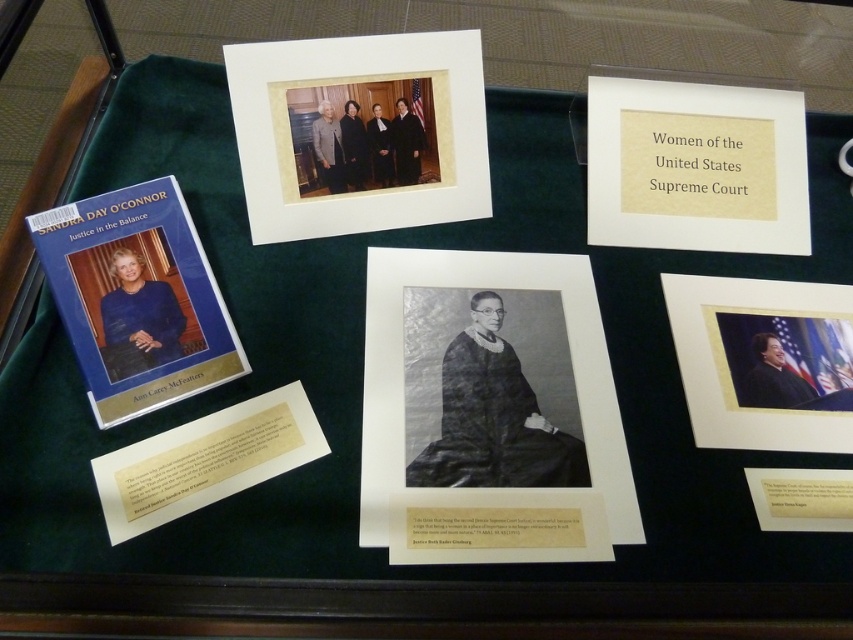
You are a museum visitor who wants to take a photo of both the black paper at center and the blue hardcover book at upper left in the display case. Which object should you focus on first to ensure both are in the frame?

You should focus on the black paper at center first because it is wider than the blue hardcover book at upper left, so centering it will help include both in the frame.

You are a visitor at a museum and want to read the text on the black paper at center and the blue hardcover book at upper left. Since you can only move forward and backward, can you read both items without moving sideways?

The black paper at center is to the right of the blue hardcover book at upper left, so if you move forward towards the display case, you can read both items without needing to move sideways as they are positioned along the same horizontal plane.